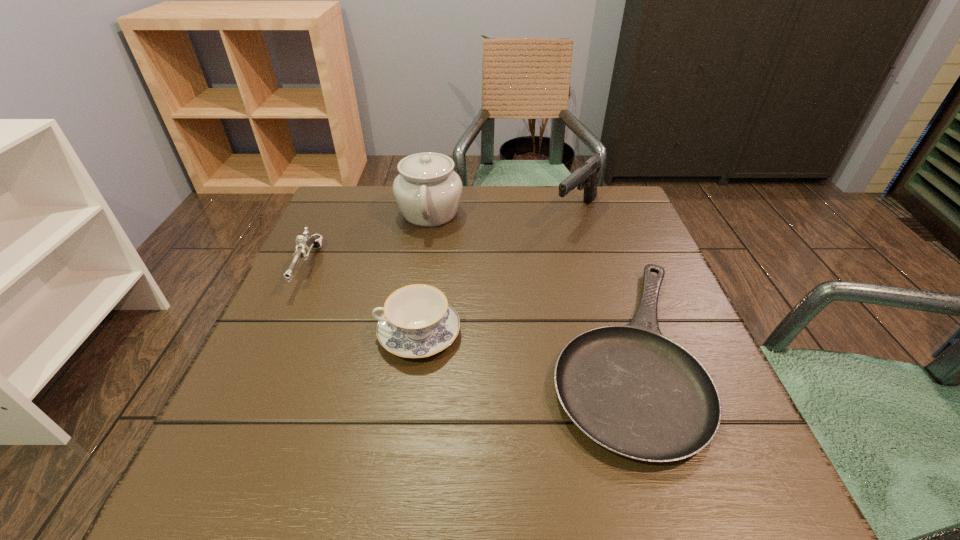
I want to click on vacant area between the shorter chinaware and the leftmost object, so click(363, 300).

You are a GUI agent. You are given a task and a screenshot of the screen. Output one action in this format:
    pyautogui.click(x=<x>, y=<y>)
    Task: Click on the free space between the left gun and the second tallest object
    This screenshot has width=960, height=540.
    Given the screenshot: What is the action you would take?
    (x=442, y=240)

The image size is (960, 540). I want to click on vacant area between the taller chinaware and the fourth shortest object, so click(503, 213).

In order to click on free space between the nearer chinaware and the taller chinaware in this screenshot , I will do `click(424, 273)`.

The width and height of the screenshot is (960, 540). Identify the location of vacant space in between the nearer chinaware and the taller gun. (497, 273).

Where is `free space between the frying pan and the taller gun`? Image resolution: width=960 pixels, height=540 pixels. free space between the frying pan and the taller gun is located at coordinates (599, 282).

The width and height of the screenshot is (960, 540). Identify the location of vacant space in between the farther gun and the taller chinaware. (503, 213).

Find the location of a particular element. unoccupied area between the taller chinaware and the shorter chinaware is located at coordinates (424, 273).

Locate an element on the screen. The width and height of the screenshot is (960, 540). the fourth closest object to the shorter chinaware is located at coordinates (586, 175).

Identify the location of object that is the fourth closest to the farther chinaware. (417, 322).